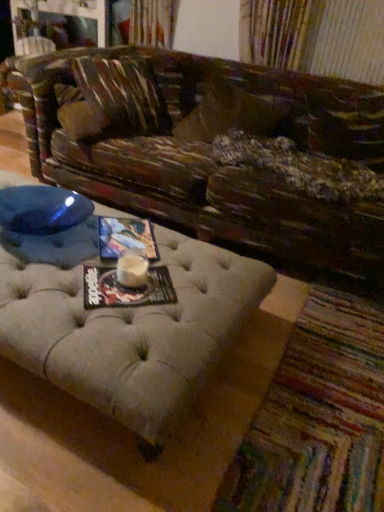
Where is `blank space situated above matte paper magazine at center, which is counted as the first magazine, starting from the bottom (from a real-world perspective)`? Image resolution: width=384 pixels, height=512 pixels. blank space situated above matte paper magazine at center, which is counted as the first magazine, starting from the bottom (from a real-world perspective) is located at coordinates (125, 281).